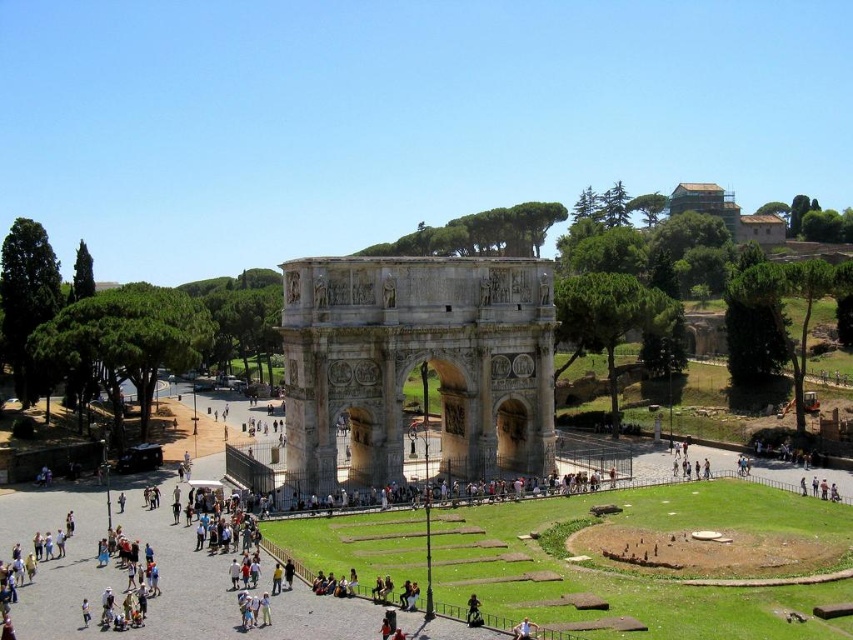
Does beige stone arch at center appear on the right side of brown wooden house at upper right?

In fact, beige stone arch at center is to the left of brown wooden house at upper right.

Consider the image. Can you confirm if beige stone arch at center is bigger than brown wooden house at upper right?

No.

Who is more forward, [341,372] or [753,237]?

Point [341,372]

The width and height of the screenshot is (853, 640). I want to click on beige stone arch at center, so click(416, 364).